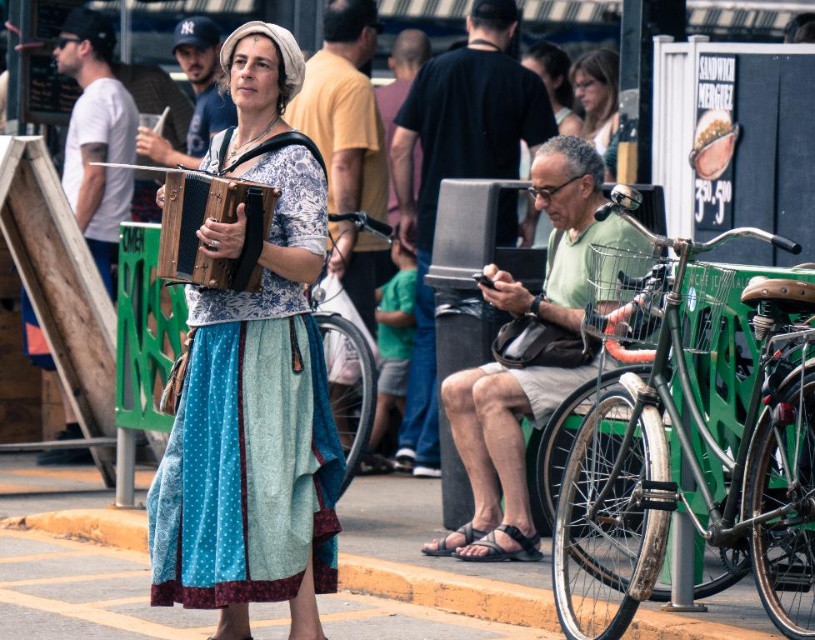
You are a photographer trying to capture the woodenobject at center and the matte black hair at upper center in the same frame. Based on their positions, which object should you focus on first to ensure both are in the shot?

The woodenobject at center is located below matte black hair at upper center, so you should focus on the matte black hair at upper center first to ensure both are in the frame.

You are a photographer trying to capture the scene from the front. You want to ensure that both the woodenobject at center and the matte black hair at upper center are in focus. Which object should you position your camera focus closer to?

The woodenobject at center is to the left of matte black hair at upper center. Since the woodenobject at center is closer to the camera, you should position your camera focus closer to the woodenobject at center to ensure both are in focus.